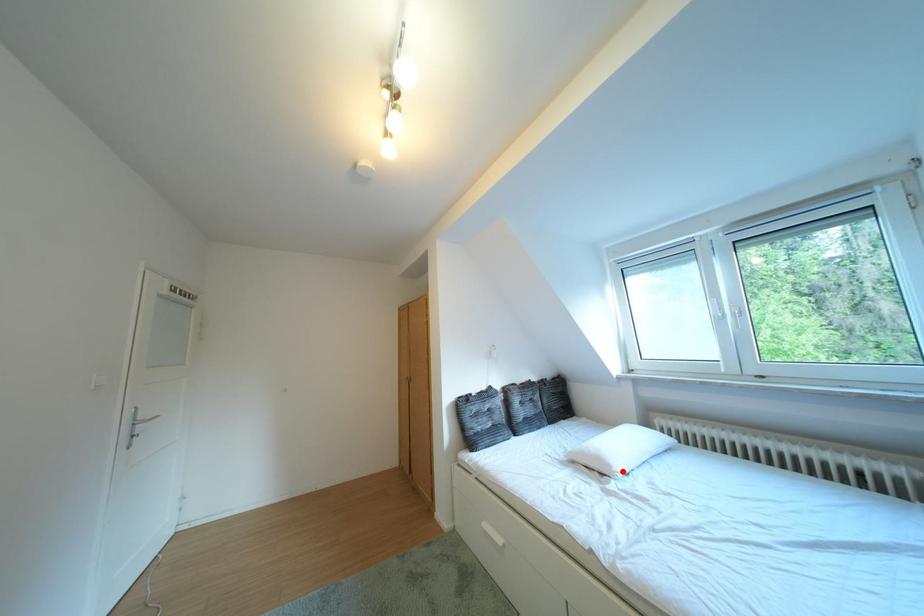
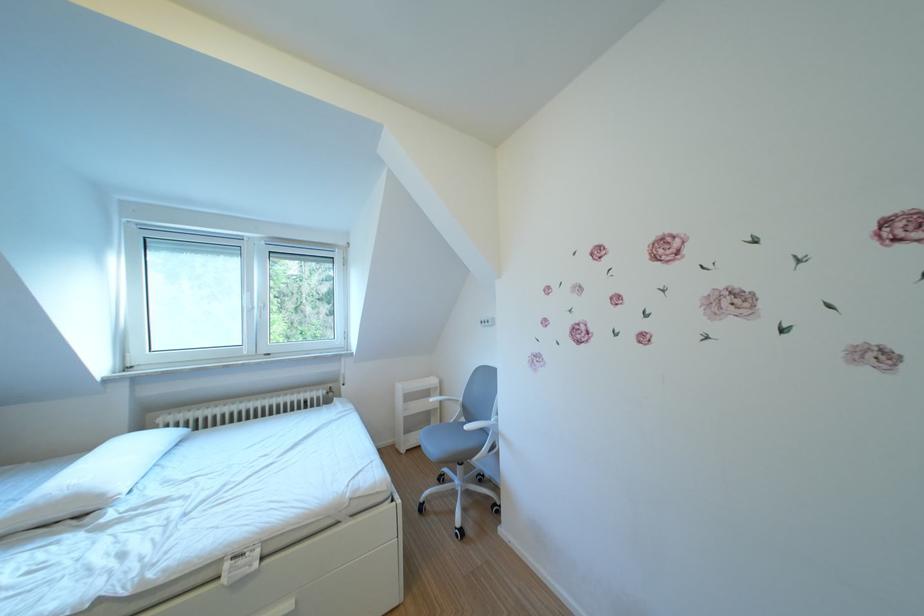
Question: I am providing you with two images of the same scene from different viewpoints. Given a red point in image1, look at the same physical point in image2. Is it:

Choices:
 (A) Closer to the viewpoint
 (B) Farther from the viewpoint

Answer: (A)